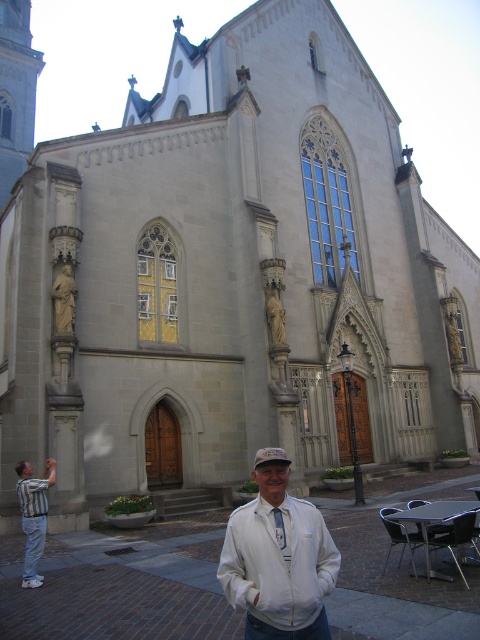
You are standing in front of the historic church building and see the point at coordinates (277, 557). What object is located at that point?

The point at coordinates (277, 557) indicates the white matte jacket at center.

You are a photographer taking a picture of the historic church. You notice a man in a white matte jacket at center and a striped cotton shirt at lower left in your frame. Which object is positioned to the right side of the other?

The white matte jacket at center is to the right of striped cotton shirt at lower left according to the description.

You are a photographer standing at the center of the image. You want to take a photo of the striped cotton shirt at lower left. Which direction should you move to get the shirt into the frame?

The striped cotton shirt at lower left is located at point (34, 515), so you should move to the right to center it in the frame.